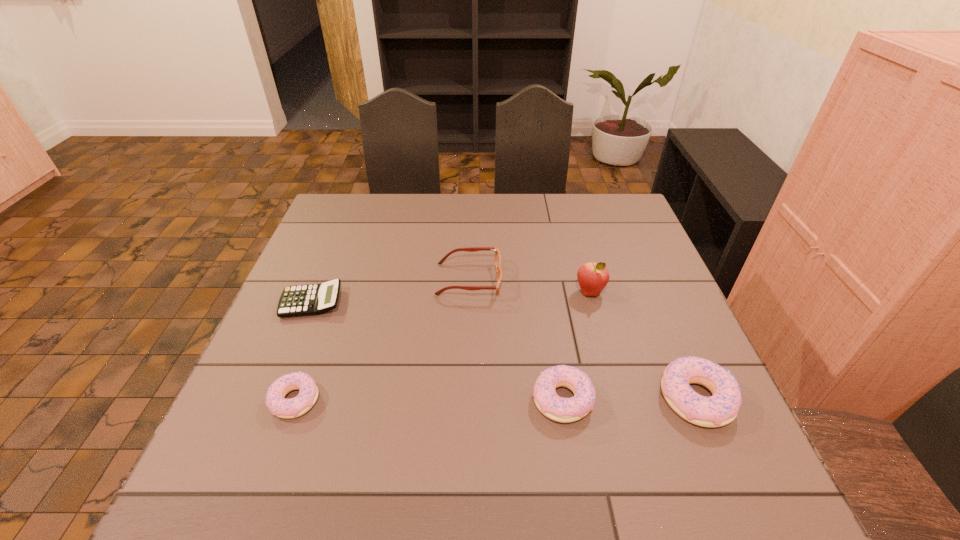
Find the location of a particular element. The image size is (960, 540). the second shortest object is located at coordinates (275, 400).

Locate an element on the screen. This screenshot has width=960, height=540. the shortest doughnut is located at coordinates (275, 400).

Locate an element on the screen. The width and height of the screenshot is (960, 540). the second shortest doughnut is located at coordinates (565, 410).

At what (x,y) coordinates should I click in order to perform the action: click on the third object from right to left. Please return your answer as a coordinate pair (x, y). This screenshot has height=540, width=960. Looking at the image, I should click on (565, 410).

Locate an element on the screen. The image size is (960, 540). the tallest doughnut is located at coordinates (722, 408).

Locate an element on the screen. The width and height of the screenshot is (960, 540). the rightmost doughnut is located at coordinates [722, 408].

You are a GUI agent. You are given a task and a screenshot of the screen. Output one action in this format:
    pyautogui.click(x=<x>, y=<y>)
    Task: Click on the calculator
    This screenshot has height=540, width=960.
    Given the screenshot: What is the action you would take?
    coord(312,299)

This screenshot has height=540, width=960. I want to click on spectacles, so click(497, 259).

Locate an element on the screen. The width and height of the screenshot is (960, 540). the tallest object is located at coordinates (592, 277).

Where is `the fifth object from left to right`? Image resolution: width=960 pixels, height=540 pixels. the fifth object from left to right is located at coordinates (592, 277).